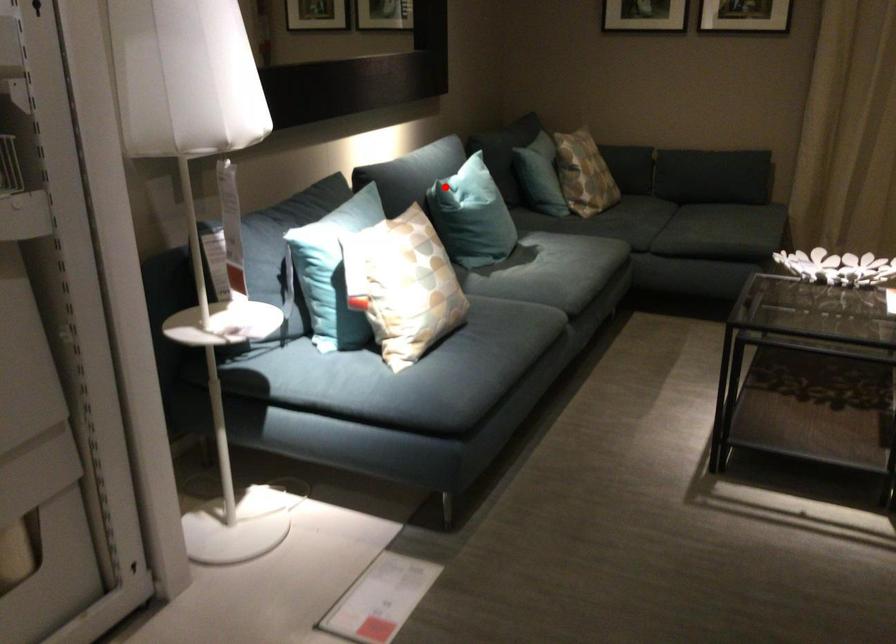
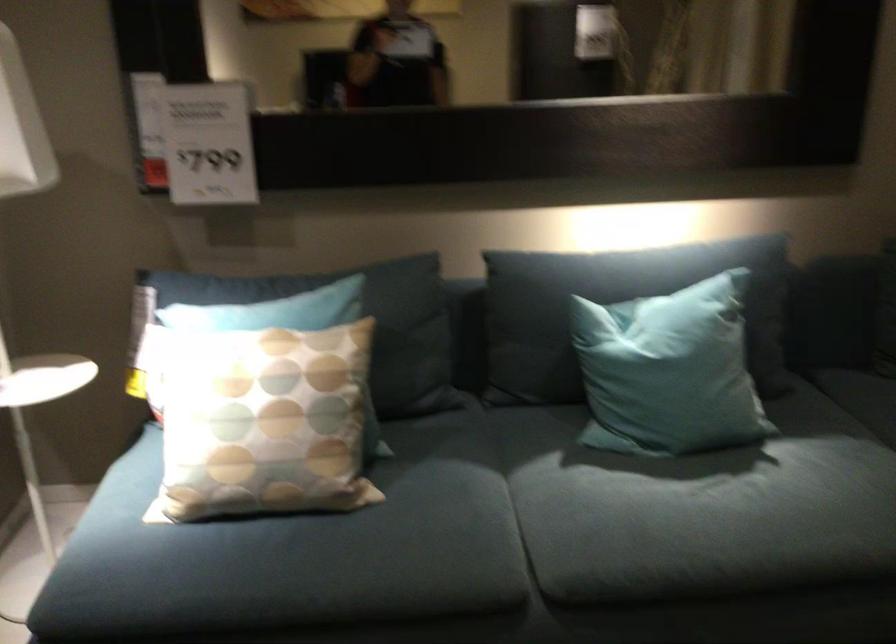
The point at the highlighted location is marked in the first image. Where is the corresponding point in the second image?

(616, 308)